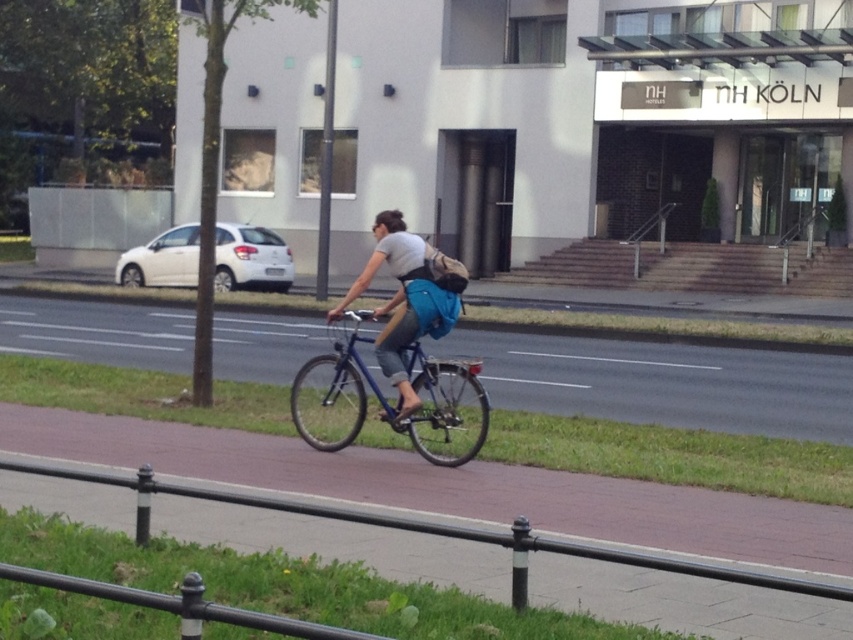
Which is below, smooth concrete pavement at center or blue metallic bicycle at center?

blue metallic bicycle at center is lower down.

Is point (527, 404) behind point (381, 397)?

Yes, point (527, 404) is behind point (381, 397).

Which is in front, point (242, 353) or point (425, 388)?

Point (425, 388)

Identify the location of smooth concrete pavement at center. The width and height of the screenshot is (853, 640). (664, 381).

Who is shorter, blue fabric backpack at center or blue metallic bicycle at center?

blue metallic bicycle at center

Consider the image. Is blue fabric backpack at center positioned before blue metallic bicycle at center?

No, blue fabric backpack at center is behind blue metallic bicycle at center.

Between point (398, 257) and point (299, 381), which one is positioned behind?

The point (299, 381) is more distant.

In order to click on blue fabric backpack at center in this screenshot , I will do `click(408, 298)`.

Measure the distance between black metal rail at lower center and camera.

They are 30.51 feet apart.

Is point (265, 500) behind point (404, 348)?

No.

Does point (198, 493) come farther from viewer compared to point (413, 428)?

No, it is not.

Locate an element on the screen. black metal rail at lower center is located at coordinates click(442, 531).